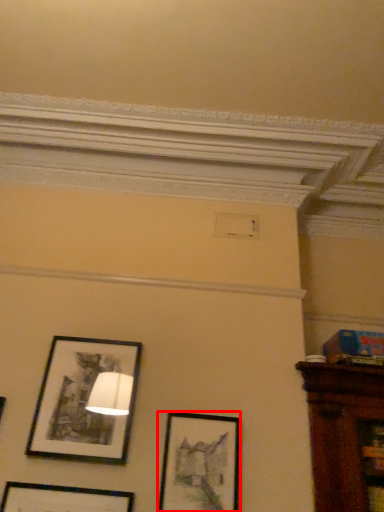
Question: Observing the image, what is the correct spatial positioning of picture frame (annotated by the red box) in reference to picture frame?

Choices:
 (A) left
 (B) right

Answer: (B)